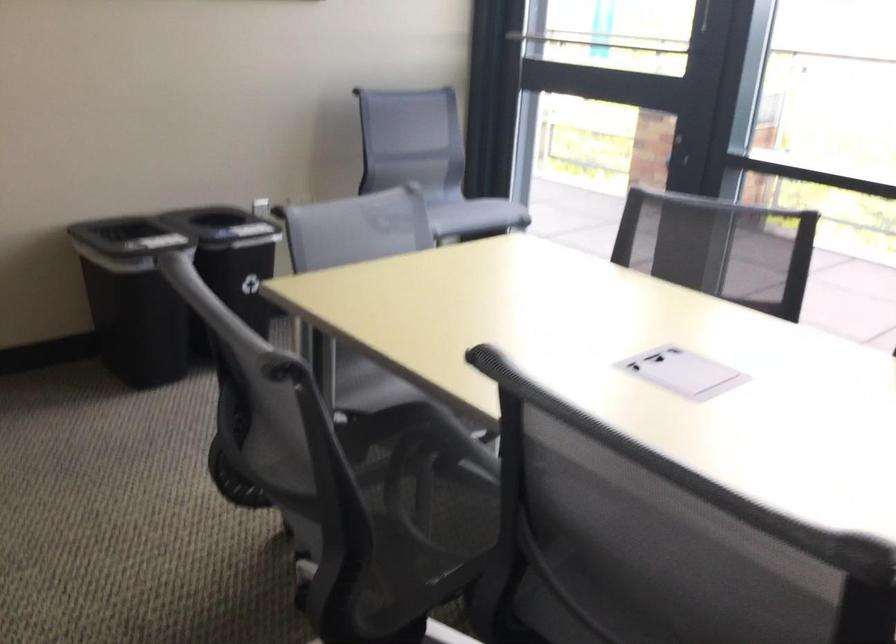
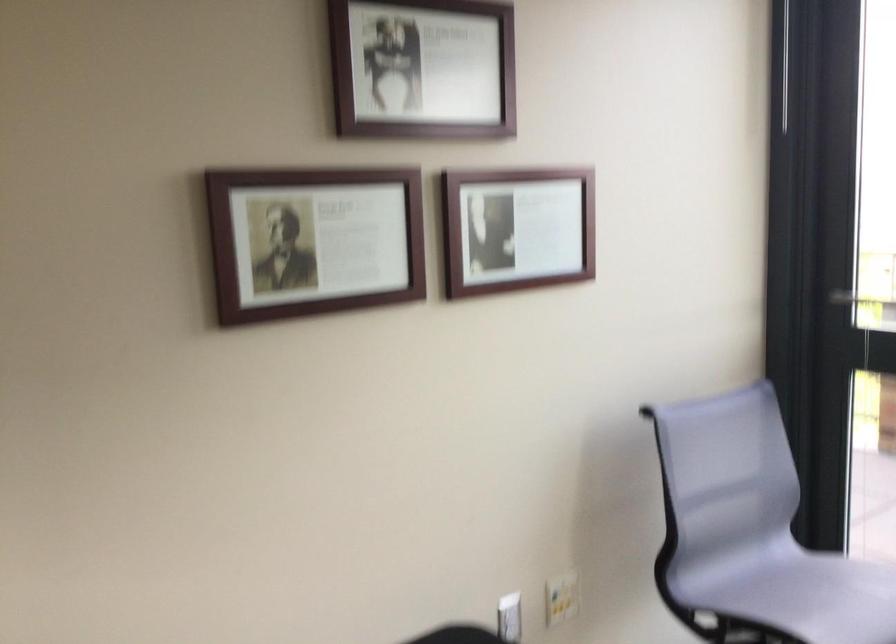
In a continuous first-person perspective shot, in which direction is the camera moving?

The cameraman moved toward left, forward.